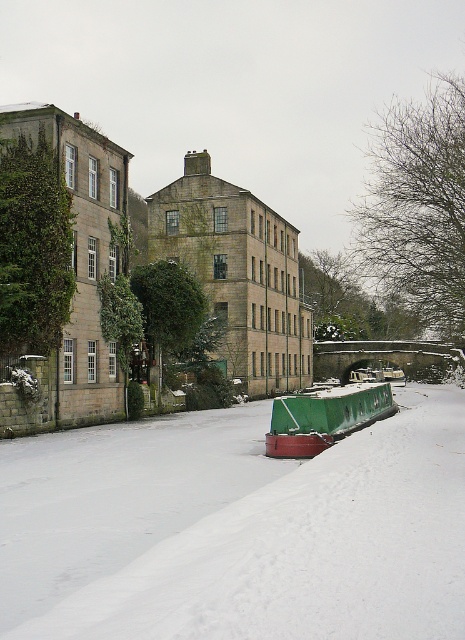
Question: Considering the relative positions of white matte snow at center and green matte barge at center in the image provided, where is white matte snow at center located with respect to green matte barge at center?

Choices:
 (A) above
 (B) below

Answer: (A)

Question: Is white matte snow at center to the right of green matte barge at center from the viewer's perspective?

Choices:
 (A) no
 (B) yes

Answer: (A)

Question: Which point is farther to the camera?

Choices:
 (A) (341, 390)
 (B) (73, 604)

Answer: (A)

Question: Which point is closer to the camera?

Choices:
 (A) white matte snow at center
 (B) green matte barge at center

Answer: (A)

Question: Does white matte snow at center lie behind green matte barge at center?

Choices:
 (A) no
 (B) yes

Answer: (A)